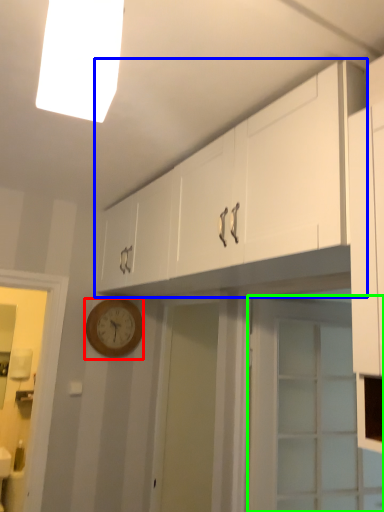
Question: Considering the real-world distances, which object is closest to wall clock (highlighted by a red box)? cabinetry (highlighted by a blue box) or door (highlighted by a green box).

Choices:
 (A) cabinetry
 (B) door

Answer: (A)